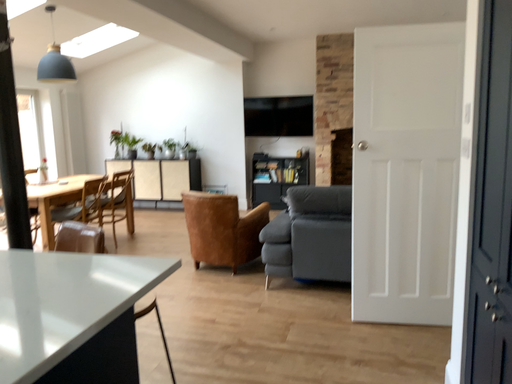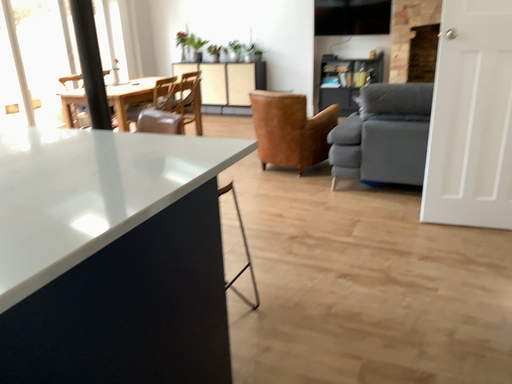
Question: Which way did the camera rotate in the video?

Choices:
 (A) rotated downward
 (B) rotated upward

Answer: (A)